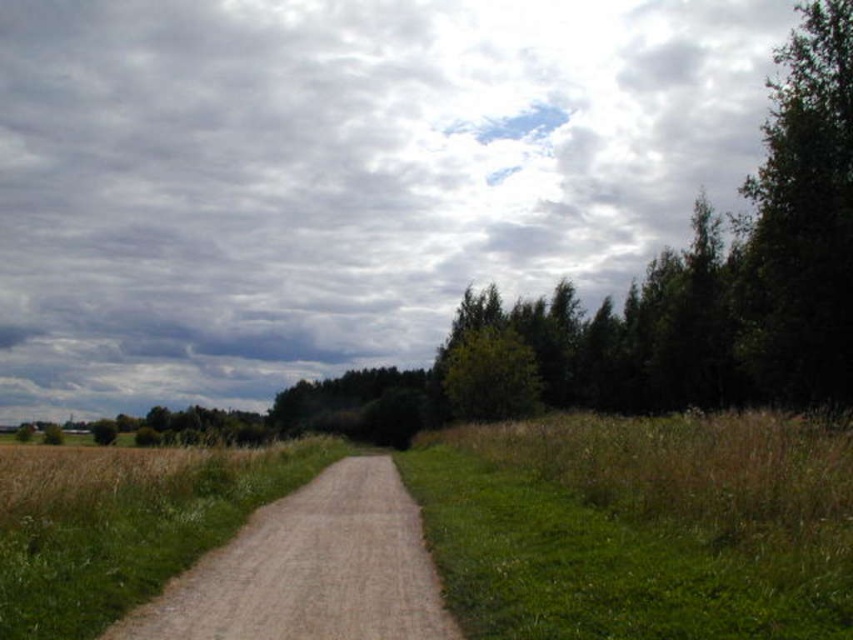
Question: Can you confirm if green grassy at right is wider than green leafy tree at right?

Choices:
 (A) no
 (B) yes

Answer: (A)

Question: Which object is the farthest from the dusty gravel path at center?

Choices:
 (A) green grassy at right
 (B) green leafy tree at right

Answer: (B)

Question: Can you confirm if dusty gravel path at center is smaller than green leafy tree at right?

Choices:
 (A) yes
 (B) no

Answer: (A)

Question: Which is nearer to the dusty gravel path at center?

Choices:
 (A) green grassy at right
 (B) green leafy tree at right

Answer: (A)

Question: Can you confirm if dusty gravel path at center is positioned to the right of green leafy tree at right?

Choices:
 (A) yes
 (B) no

Answer: (B)

Question: Which of the following is the farthest from the observer?

Choices:
 (A) dusty gravel path at center
 (B) green grassy at right
 (C) green leafy tree at right

Answer: (C)